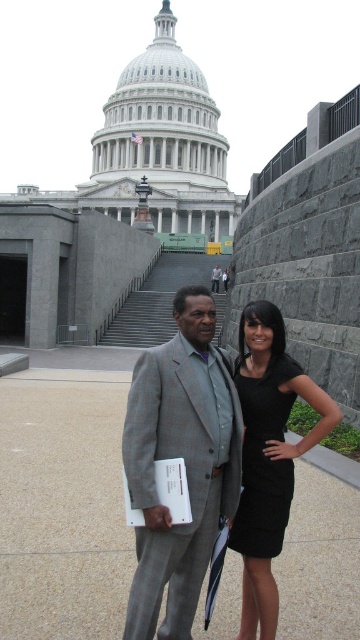
Does gray textured suit at center appear over black satin dress at center?

Actually, gray textured suit at center is below black satin dress at center.

Is gray textured suit at center shorter than black satin dress at center?

In fact, gray textured suit at center may be taller than black satin dress at center.

Identify the location of gray textured suit at center. The image size is (360, 640). (185, 465).

Can you confirm if black textured dress at center is shorter than gray suit at center?

Incorrect, black textured dress at center's height does not fall short of gray suit at center's.

Does point (251, 442) come behind point (213, 285)?

No, (251, 442) is in front of (213, 285).

The image size is (360, 640). Find the location of `black textured dress at center`. black textured dress at center is located at coordinates (263, 461).

Is point (185, 390) positioned after point (222, 273)?

No, (185, 390) is in front of (222, 273).

Between point (204, 458) and point (213, 276), which one is positioned behind?

Point (213, 276)

Identify the location of gray textured suit at center. (185, 465).